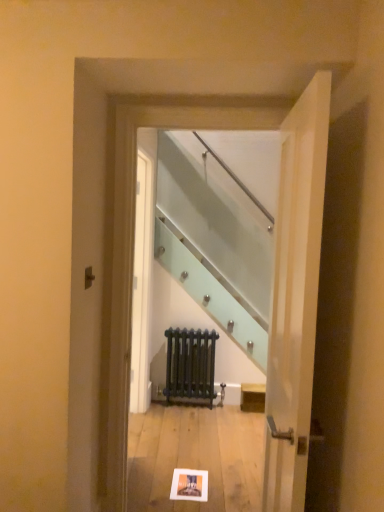
The image size is (384, 512). Identify the location of free region under matte black radiator at center (from a real-world perspective). (192, 397).